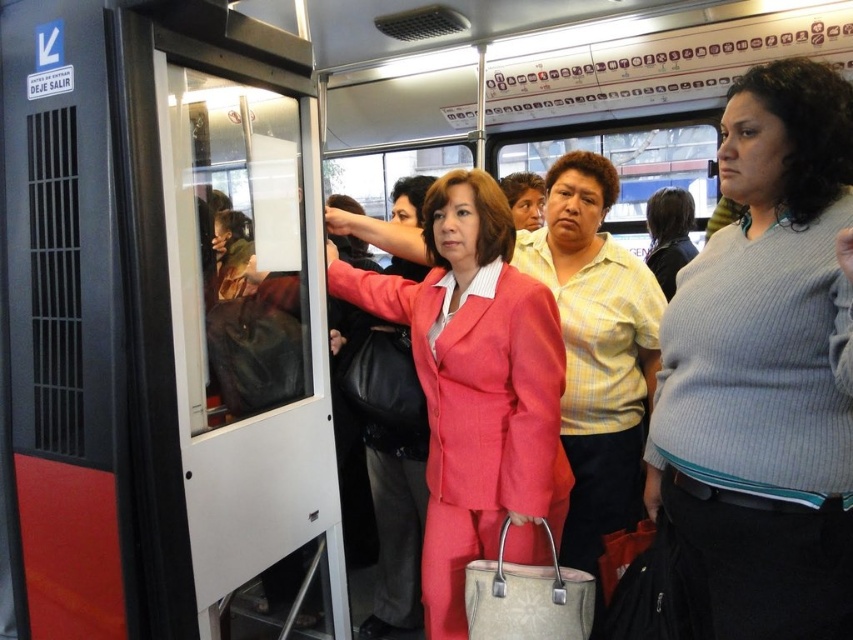
Can you confirm if ribbed gray sweater at right is smaller than matte pink suit at center?

Indeed, ribbed gray sweater at right has a smaller size compared to matte pink suit at center.

The height and width of the screenshot is (640, 853). What do you see at coordinates (764, 372) in the screenshot? I see `ribbed gray sweater at right` at bounding box center [764, 372].

This screenshot has width=853, height=640. What are the coordinates of `ribbed gray sweater at right` in the screenshot? It's located at (764, 372).

Is matte pink suit at center closer to camera compared to yellow striped shirt at center?

Yes, matte pink suit at center is in front of yellow striped shirt at center.

Does point (444, 484) come closer to viewer compared to point (596, 348)?

That is True.

Identify the location of matte pink suit at center. This screenshot has width=853, height=640. (476, 388).

Can you confirm if ribbed gray sweater at right is smaller than yellow striped shirt at center?

Incorrect, ribbed gray sweater at right is not smaller in size than yellow striped shirt at center.

Based on the photo, who is more distant from viewer, (x=802, y=145) or (x=581, y=390)?

The point (x=581, y=390) is behind.

Identify the location of ribbed gray sweater at right. (764, 372).